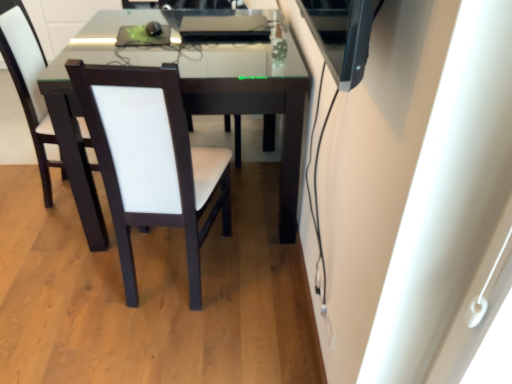
Where is `vacant space in white leather chair at center, the 2th chair in the left-to-right sequence (from a real-world perspective)`? vacant space in white leather chair at center, the 2th chair in the left-to-right sequence (from a real-world perspective) is located at coordinates (172, 269).